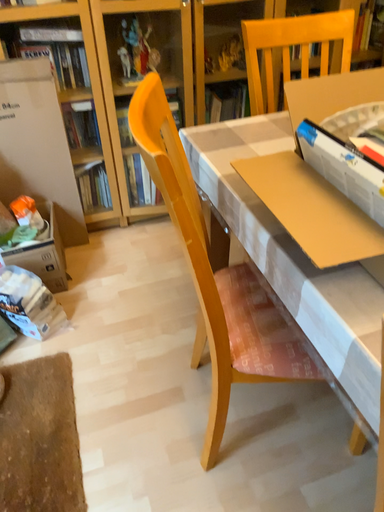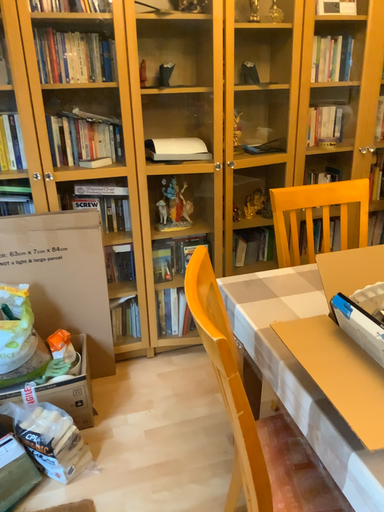
Question: Which way did the camera rotate in the video?

Choices:
 (A) rotated downward
 (B) rotated upward

Answer: (B)